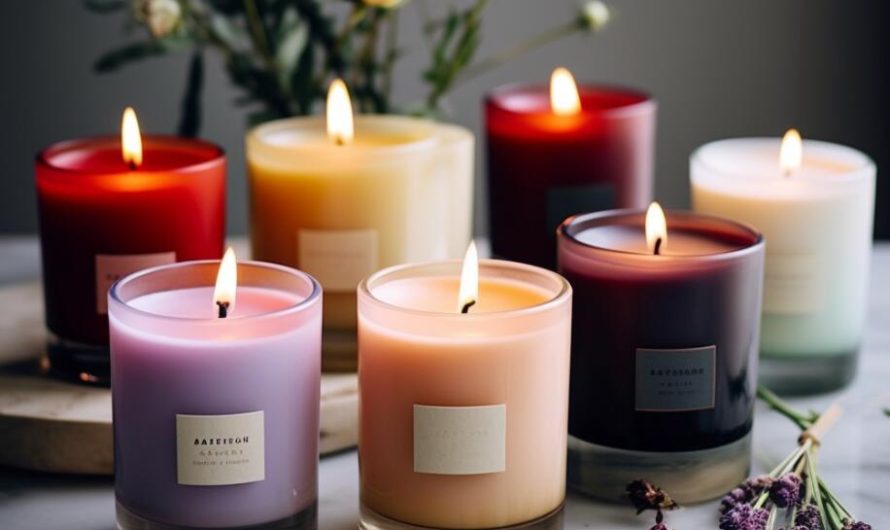
Where is `candle flame`? candle flame is located at coordinates (132, 131), (227, 273), (336, 104), (468, 280), (564, 94), (656, 218), (794, 151).